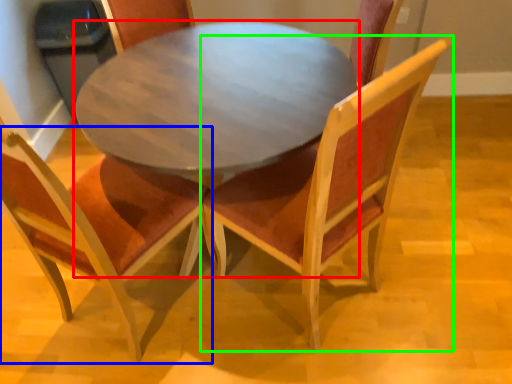
Question: Which is nearer to the coffee table (highlighted by a red box)? chair (highlighted by a blue box) or chair (highlighted by a green box).

Choices:
 (A) chair
 (B) chair

Answer: (B)